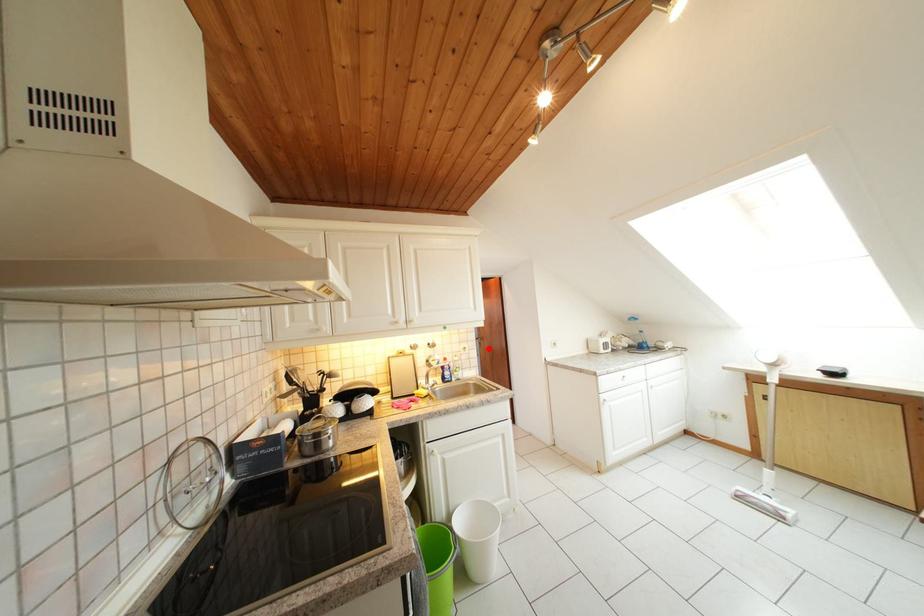
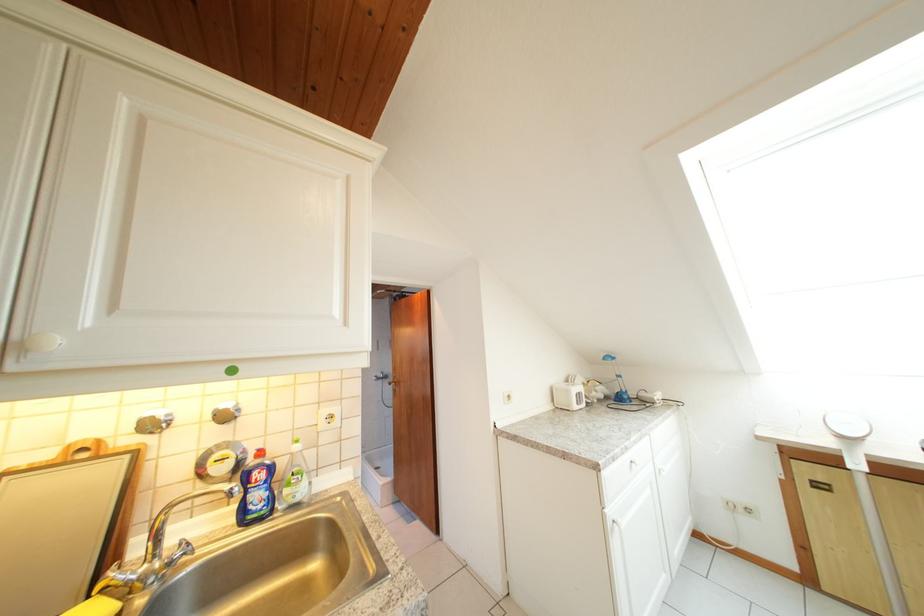
Where in the second image is the point corresponding to the highlighted location from the first image?

(403, 395)